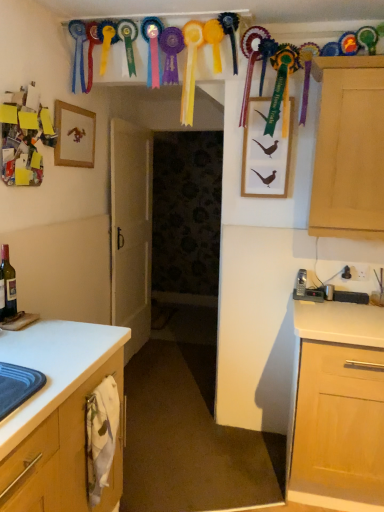
Image resolution: width=384 pixels, height=512 pixels. Describe the element at coordinates (131, 230) in the screenshot. I see `white matte door at center` at that location.

What is the approximate width of wooden framed picture of birds at upper center, placed as the second picture frame when sorted from left to right?

wooden framed picture of birds at upper center, placed as the second picture frame when sorted from left to right, is 4.29 centimeters wide.

What do you see at coordinates (74, 136) in the screenshot? This screenshot has height=512, width=384. I see `wooden picture frame at upper left, the first picture frame positioned from the left` at bounding box center [74, 136].

The height and width of the screenshot is (512, 384). I want to click on light wood cabinet at right, so click(349, 149).

Is wooden picture frame at upper left, the 2th picture frame from the right, bigger than white matte door at center?

Incorrect, wooden picture frame at upper left, the 2th picture frame from the right, is not larger than white matte door at center.

Between wooden picture frame at upper left, the first picture frame positioned from the left, and white matte door at center, which one has more height?

With more height is white matte door at center.

Can you confirm if wooden picture frame at upper left, the 2th picture frame from the right, is wider than white matte door at center?

No.

Considering the sizes of objects light wood cabinet at right and wooden framed picture of birds at upper center, arranged as the 1th picture frame when viewed from the right, in the image provided, who is bigger, light wood cabinet at right or wooden framed picture of birds at upper center, arranged as the 1th picture frame when viewed from the right,?

Bigger between the two is light wood cabinet at right.

From a real-world perspective, is light wood cabinet at right over wooden framed picture of birds at upper center, placed as the second picture frame when sorted from left to right?

No, from a real-world perspective, light wood cabinet at right is not on top of wooden framed picture of birds at upper center, placed as the second picture frame when sorted from left to right.

Could you tell me if light wood cabinet at right is facing wooden framed picture of birds at upper center, placed as the second picture frame when sorted from left to right?

No, light wood cabinet at right is not turned towards wooden framed picture of birds at upper center, placed as the second picture frame when sorted from left to right.

Relative to wooden framed picture of birds at upper center, arranged as the 1th picture frame when viewed from the right, is light wood cabinet at right in front or behind?

Visually, light wood cabinet at right is located in front of wooden framed picture of birds at upper center, arranged as the 1th picture frame when viewed from the right.

Consider the image. Is white matte door at center turned away from matte glass bottle at left?

No, white matte door at center's orientation is not away from matte glass bottle at left.

Can you confirm if white matte door at center is positioned to the left of matte glass bottle at left?

In fact, white matte door at center is to the right of matte glass bottle at left.

Can you tell me how much white matte door at center and matte glass bottle at left differ in facing direction?

There is a 0.0707-degree angle between the facing directions of white matte door at center and matte glass bottle at left.

Locate an element on the screen. This screenshot has width=384, height=512. beer bottle positioned vertically above the white matte door at center (from a real-world perspective) is located at coordinates (9, 283).

From the image's perspective, is wooden framed picture of birds at upper center, placed as the second picture frame when sorted from left to right, on top of white matte door at center?

Yes, from the image's perspective, wooden framed picture of birds at upper center, placed as the second picture frame when sorted from left to right, is above white matte door at center.

Can you confirm if wooden framed picture of birds at upper center, placed as the second picture frame when sorted from left to right, is taller than white matte door at center?

In fact, wooden framed picture of birds at upper center, placed as the second picture frame when sorted from left to right, may be shorter than white matte door at center.

Is wooden framed picture of birds at upper center, arranged as the 1th picture frame when viewed from the right, aimed at white matte door at center?

No.

From the image's perspective, is wooden framed picture of birds at upper center, placed as the second picture frame when sorted from left to right, located beneath light wood cabinet at right?

Actually, wooden framed picture of birds at upper center, placed as the second picture frame when sorted from left to right, appears above light wood cabinet at right in the image.

In the image, is wooden framed picture of birds at upper center, placed as the second picture frame when sorted from left to right, on the left side or the right side of light wood cabinet at right?

Based on their positions, wooden framed picture of birds at upper center, placed as the second picture frame when sorted from left to right, is located to the left of light wood cabinet at right.

Considering their positions, is wooden framed picture of birds at upper center, placed as the second picture frame when sorted from left to right, located in front of or behind light wood cabinet at right?

Visually, wooden framed picture of birds at upper center, placed as the second picture frame when sorted from left to right, is located behind light wood cabinet at right.

Considering the sizes of objects white matte door at center and wooden framed picture of birds at upper center, arranged as the 1th picture frame when viewed from the right, in the image provided, who is bigger, white matte door at center or wooden framed picture of birds at upper center, arranged as the 1th picture frame when viewed from the right,?

With larger size is white matte door at center.

From a real-world perspective, who is located higher, white matte door at center or wooden framed picture of birds at upper center, arranged as the 1th picture frame when viewed from the right?

wooden framed picture of birds at upper center, arranged as the 1th picture frame when viewed from the right, from a real-world perspective.

Which is more to the left, white matte door at center or wooden framed picture of birds at upper center, placed as the second picture frame when sorted from left to right?

white matte door at center is more to the left.

Is the position of white matte door at center more distant than that of wooden framed picture of birds at upper center, arranged as the 1th picture frame when viewed from the right?

Yes, it is.

Between wooden picture frame at upper left, the 2th picture frame from the right, and wooden framed picture of birds at upper center, placed as the second picture frame when sorted from left to right, which one has more height?

wooden framed picture of birds at upper center, placed as the second picture frame when sorted from left to right, is taller.

Which is in front, point (93, 131) or point (267, 191)?

Positioned in front is point (267, 191).

Is wooden picture frame at upper left, the first picture frame positioned from the left, facing towards wooden framed picture of birds at upper center, placed as the second picture frame when sorted from left to right?

Yes, wooden picture frame at upper left, the first picture frame positioned from the left, is turned towards wooden framed picture of birds at upper center, placed as the second picture frame when sorted from left to right.

Considering the sizes of objects wooden picture frame at upper left, the 2th picture frame from the right, and wooden framed picture of birds at upper center, placed as the second picture frame when sorted from left to right, in the image provided, who is bigger, wooden picture frame at upper left, the 2th picture frame from the right, or wooden framed picture of birds at upper center, placed as the second picture frame when sorted from left to right,?

wooden framed picture of birds at upper center, placed as the second picture frame when sorted from left to right, is bigger.

Locate an element on the screen. The width and height of the screenshot is (384, 512). the 2nd picture frame directly above the white matte door at center (from a real-world perspective) is located at coordinates (74, 136).

Image resolution: width=384 pixels, height=512 pixels. In order to click on cabinetry below the wooden framed picture of birds at upper center, arranged as the 1th picture frame when viewed from the right (from a real-world perspective) in this screenshot , I will do `click(349, 149)`.

Estimate the real-world distances between objects in this image. Which object is closer to matte glass bottle at left, white matte door at center or wooden picture frame at upper left, the 2th picture frame from the right?

Based on the image, wooden picture frame at upper left, the 2th picture frame from the right, appears to be nearer to matte glass bottle at left.

Which object lies nearer to the anchor point wooden framed picture of birds at upper center, arranged as the 1th picture frame when viewed from the right, wooden picture frame at upper left, the 2th picture frame from the right, or light wood cabinet at right?

Based on the image, light wood cabinet at right appears to be nearer to wooden framed picture of birds at upper center, arranged as the 1th picture frame when viewed from the right.

When comparing their distances from wooden framed picture of birds at upper center, arranged as the 1th picture frame when viewed from the right, does wooden picture frame at upper left, the first picture frame positioned from the left, or matte glass bottle at left seem further?

Based on the image, matte glass bottle at left appears to be further to wooden framed picture of birds at upper center, arranged as the 1th picture frame when viewed from the right.

Consider the image. When comparing their distances from wooden framed picture of birds at upper center, placed as the second picture frame when sorted from left to right, does white matte door at center or matte glass bottle at left seem further?

matte glass bottle at left.

From the picture: Considering their positions, is wooden picture frame at upper left, the first picture frame positioned from the left, positioned further to light wood cabinet at right than white matte door at center?

white matte door at center lies further to light wood cabinet at right than the other object.

Based on their spatial positions, is light wood cabinet at right or white matte door at center further from wooden framed picture of birds at upper center, placed as the second picture frame when sorted from left to right?

white matte door at center is further to wooden framed picture of birds at upper center, placed as the second picture frame when sorted from left to right.

Considering their positions, is white matte door at center positioned further to matte glass bottle at left than wooden framed picture of birds at upper center, placed as the second picture frame when sorted from left to right?

Based on the image, white matte door at center appears to be further to matte glass bottle at left.

From the image, which object appears to be nearer to matte glass bottle at left, light wood cabinet at right or wooden picture frame at upper left, the first picture frame positioned from the left?

Among the two, wooden picture frame at upper left, the first picture frame positioned from the left, is located nearer to matte glass bottle at left.

Where is `door between wooden picture frame at upper left, the first picture frame positioned from the left, and light wood cabinet at right from left to right`? The width and height of the screenshot is (384, 512). door between wooden picture frame at upper left, the first picture frame positioned from the left, and light wood cabinet at right from left to right is located at coordinates (131, 230).

Locate an element on the screen. This screenshot has width=384, height=512. picture frame between wooden picture frame at upper left, the 2th picture frame from the right, and light wood cabinet at right is located at coordinates (265, 153).

You are a GUI agent. You are given a task and a screenshot of the screen. Output one action in this format:
    pyautogui.click(x=<x>, y=<y>)
    Task: Click on the picture frame between white matte door at center and light wood cabinet at right
    This screenshot has height=512, width=384.
    Given the screenshot: What is the action you would take?
    pyautogui.click(x=265, y=153)

Where is `door between matte glass bottle at left and wooden framed picture of birds at upper center, placed as the second picture frame when sorted from left to right, in the horizontal direction`? Image resolution: width=384 pixels, height=512 pixels. door between matte glass bottle at left and wooden framed picture of birds at upper center, placed as the second picture frame when sorted from left to right, in the horizontal direction is located at coordinates (131, 230).